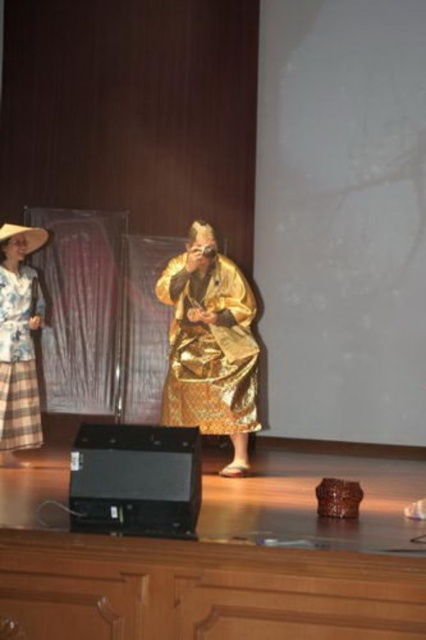
Question: Which object appears farthest from the camera in this image?

Choices:
 (A) matte floral dress at left
 (B) gold shiny robe at center

Answer: (A)

Question: In this image, where is gold shiny robe at center located relative to matte floral dress at left?

Choices:
 (A) above
 (B) below

Answer: (B)

Question: Does gold shiny robe at center lie behind matte floral dress at left?

Choices:
 (A) yes
 (B) no

Answer: (B)

Question: Is gold shiny robe at center below matte floral dress at left?

Choices:
 (A) no
 (B) yes

Answer: (B)

Question: Among these points, which one is nearest to the camera?

Choices:
 (A) (6, 384)
 (B) (207, 298)

Answer: (B)